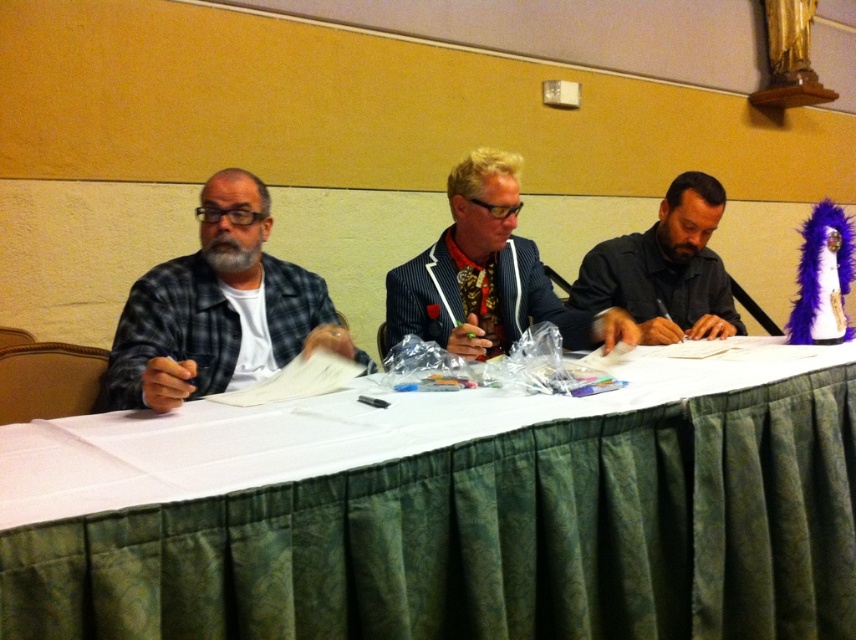
You are sitting at the table and want to place a small notebook between the green textured tablecloth at center and the dark gray shirt at right. Based on their positions, where should you place the notebook?

The green textured tablecloth at center is in front of the dark gray shirt at right, so you should place the notebook between them, closer to the tablecloth since it is positioned in front of the shirt.

Where is the plaid fabric shirt at left located in the image?

The plaid fabric shirt at left is located at point (218, 308) in the image.

You are organizing a meeting and need to ensure that the green textured tablecloth at center covers the entire table. Given that the plaid fabric shirt at left is partially visible under the tablecloth, can you confirm if the tablecloth is long enough to cover the shirt?

The green textured tablecloth at center has a larger size compared to plaid fabric shirt at left, so it should be long enough to cover the plaid fabric shirt at left if properly arranged.